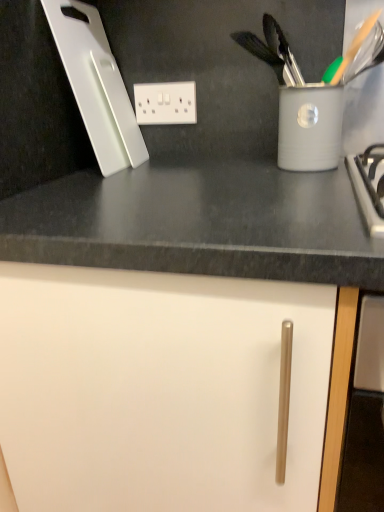
Question: Considering the relative sizes of white plastic electric outlet at upper center and white plastic cutting board at upper left in the image provided, is white plastic electric outlet at upper center thinner than white plastic cutting board at upper left?

Choices:
 (A) yes
 (B) no

Answer: (A)

Question: From the image's perspective, would you say white plastic electric outlet at upper center is shown under white plastic cutting board at upper left?

Choices:
 (A) no
 (B) yes

Answer: (B)

Question: Is white plastic electric outlet at upper center not near white plastic cutting board at upper left?

Choices:
 (A) yes
 (B) no

Answer: (B)

Question: Is white plastic electric outlet at upper center oriented away from white plastic cutting board at upper left?

Choices:
 (A) yes
 (B) no

Answer: (B)

Question: Considering the relative sizes of white plastic electric outlet at upper center and white plastic cutting board at upper left in the image provided, is white plastic electric outlet at upper center shorter than white plastic cutting board at upper left?

Choices:
 (A) yes
 (B) no

Answer: (A)

Question: Does point (79, 2) appear closer or farther from the camera than point (228, 451)?

Choices:
 (A) farther
 (B) closer

Answer: (A)

Question: Considering their positions, is white plastic cutting board at upper left located in front of or behind white matte cabinet door at center?

Choices:
 (A) behind
 (B) front

Answer: (A)

Question: Considering the positions of white plastic cutting board at upper left and white matte cabinet door at center in the image, is white plastic cutting board at upper left taller or shorter than white matte cabinet door at center?

Choices:
 (A) tall
 (B) short

Answer: (B)

Question: Looking at the image, does white plastic cutting board at upper left seem bigger or smaller compared to white matte cabinet door at center?

Choices:
 (A) big
 (B) small

Answer: (B)

Question: Considering the relative positions of white matte cabinet door at center and white plastic electric outlet at upper center in the image provided, is white matte cabinet door at center to the left or to the right of white plastic electric outlet at upper center?

Choices:
 (A) right
 (B) left

Answer: (A)

Question: In the image, is white matte cabinet door at center positioned in front of or behind white plastic electric outlet at upper center?

Choices:
 (A) behind
 (B) front

Answer: (B)

Question: From a real-world perspective, relative to white plastic electric outlet at upper center, is white matte cabinet door at center vertically above or below?

Choices:
 (A) above
 (B) below

Answer: (B)

Question: Choose the correct answer: Is white matte cabinet door at center inside white plastic electric outlet at upper center or outside it?

Choices:
 (A) inside
 (B) outside

Answer: (B)

Question: Is white plastic electric outlet at upper center inside or outside of white plastic cutting board at upper left?

Choices:
 (A) inside
 (B) outside

Answer: (B)

Question: Considering the positions of white plastic electric outlet at upper center and white plastic cutting board at upper left in the image, is white plastic electric outlet at upper center wider or thinner than white plastic cutting board at upper left?

Choices:
 (A) wide
 (B) thin

Answer: (B)